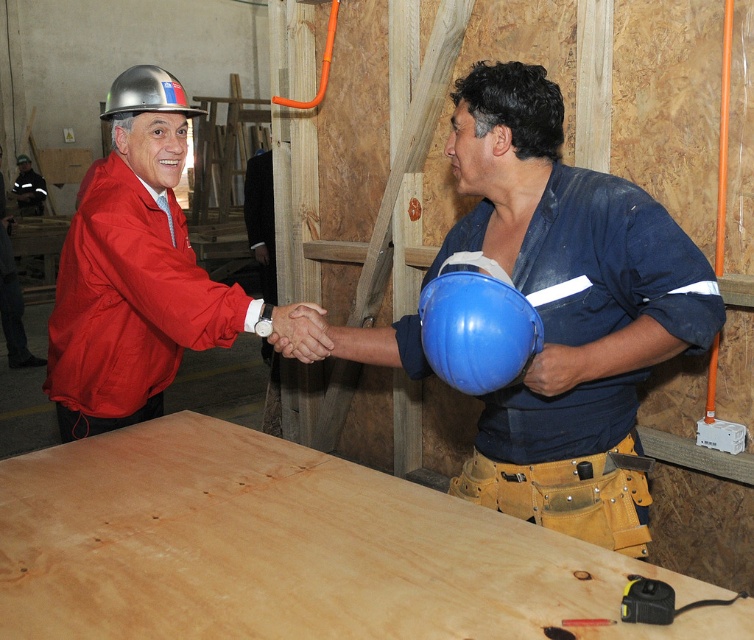
Question: Which object is the farthest from the matte silver hard hat at left?

Choices:
 (A) metallic hard hat at upper left
 (B) matte black helmet at upper left

Answer: (B)

Question: Among these objects, which one is nearest to the camera?

Choices:
 (A) matte silver hard hat at left
 (B) metallic hard hat at upper left

Answer: (A)

Question: Can you confirm if natural wood plywood at center is smaller than matte black helmet at upper left?

Choices:
 (A) yes
 (B) no

Answer: (B)

Question: Which object is positioned farthest from the metallic hard hat at upper left?

Choices:
 (A) matte black helmet at upper left
 (B) matte silver hard hat at left

Answer: (A)

Question: From the image, what is the correct spatial relationship of blue matte helmet at center in relation to metallic hard hat at upper left?

Choices:
 (A) above
 (B) below

Answer: (B)

Question: Is metallic hard hat at upper left to the right of matte black helmet at upper left from the viewer's perspective?

Choices:
 (A) no
 (B) yes

Answer: (B)